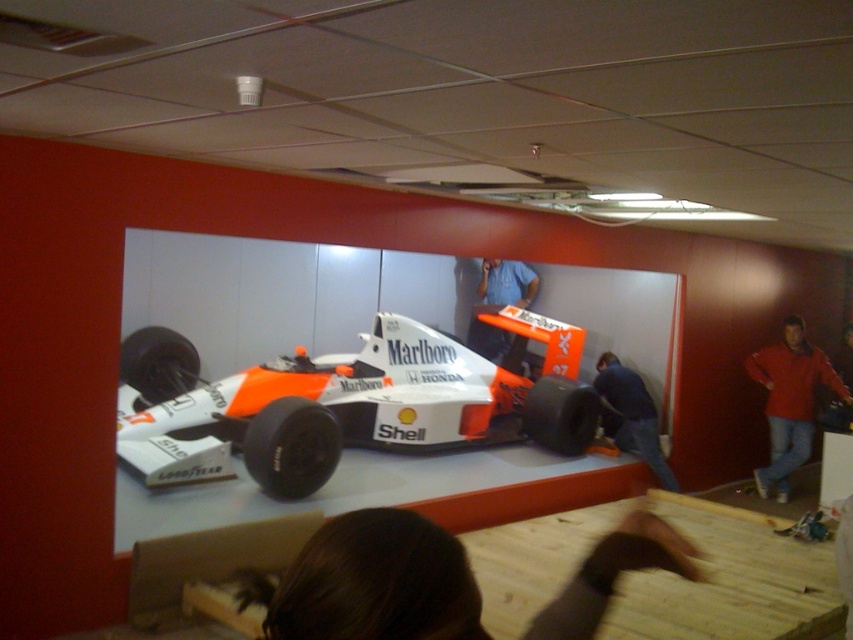
Question: Which point is farther from the camera taking this photo?

Choices:
 (A) (482, 285)
 (B) (643, 388)
 (C) (619, 532)

Answer: (A)

Question: Which point appears closest to the camera in this image?

Choices:
 (A) (489, 372)
 (B) (376, 540)

Answer: (B)

Question: Does white matte race car at center come in front of dark blue fabric at lower center?

Choices:
 (A) yes
 (B) no

Answer: (A)

Question: Which point is farther to the camera?

Choices:
 (A) (569, 582)
 (B) (531, 291)
 (C) (790, 326)

Answer: (B)

Question: Where is brown hair at lower center located in relation to red cotton hoodie at lower right in the image?

Choices:
 (A) above
 (B) below

Answer: (A)

Question: Does white matte race car at center lie behind blue fabric shirt at center?

Choices:
 (A) no
 (B) yes

Answer: (A)